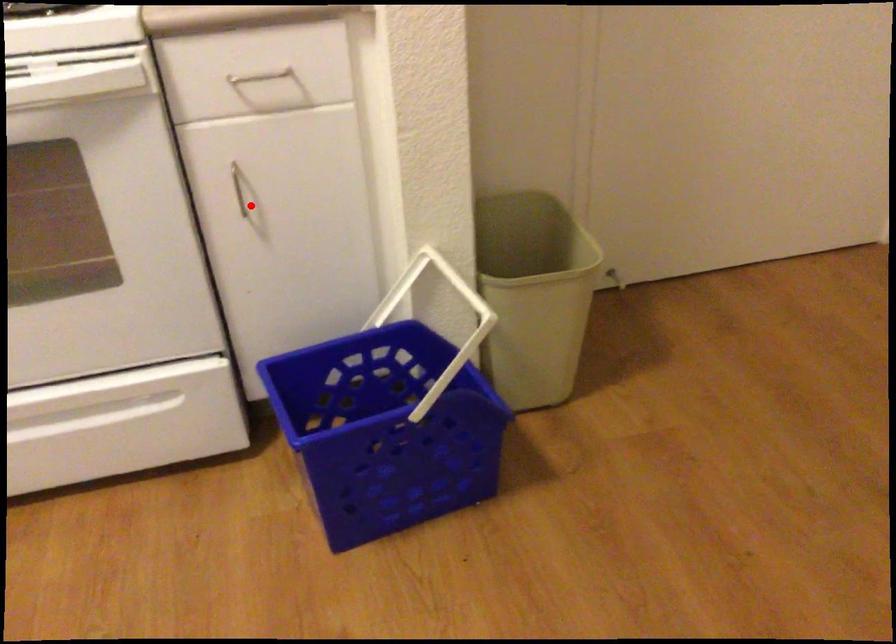
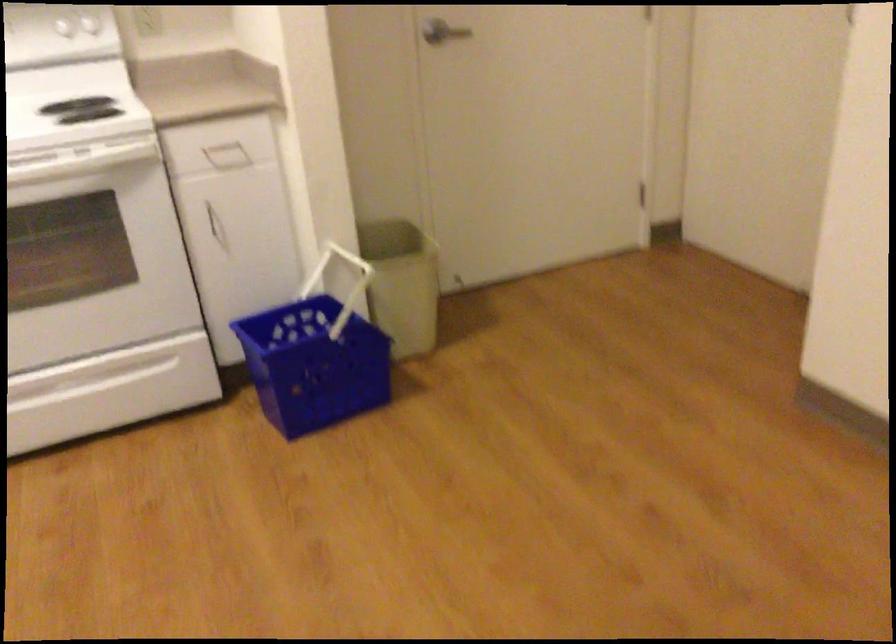
In the second image, find the point that corresponds to the highlighted location in the first image.

(216, 225)